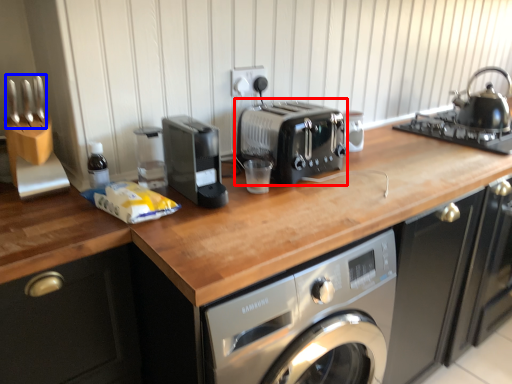
Question: Which of the following is the closest to the observer, toaster (highlighted by a red box) or cutlery (highlighted by a blue box)?

Choices:
 (A) toaster
 (B) cutlery

Answer: (B)